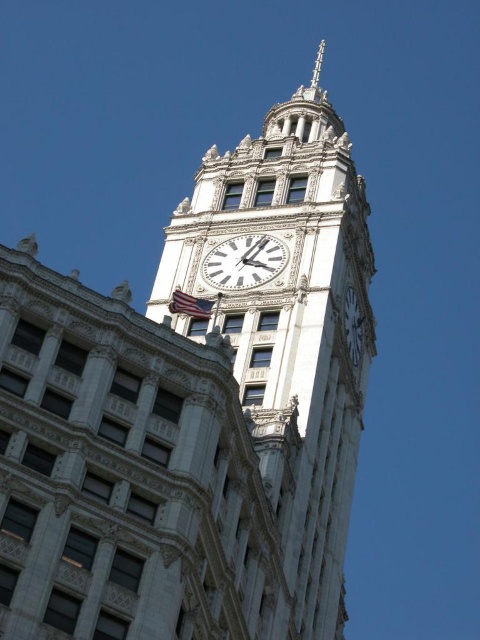
This screenshot has width=480, height=640. What are the coordinates of `white stone clock tower at center` in the screenshot? It's located at (291, 317).

Can you confirm if white stone clock tower at center is positioned to the right of american flag at center?

Correct, you'll find white stone clock tower at center to the right of american flag at center.

Which is in front, point (348, 388) or point (187, 292)?

Point (187, 292)

Where is `white stone clock tower at center`? Image resolution: width=480 pixels, height=640 pixels. white stone clock tower at center is located at coordinates (291, 317).

Which is behind, point (360, 332) or point (320, 67)?

The point (320, 67) is behind.

Is white stone clock at upper center to the right of polished silver spire at upper center from the viewer's perspective?

In fact, white stone clock at upper center is to the left of polished silver spire at upper center.

The width and height of the screenshot is (480, 640). I want to click on white stone clock at upper center, so click(352, 324).

Is white stone clock at upper center positioned before american flag at center?

No, white stone clock at upper center is further to the viewer.

In the scene shown: Who is higher up, white stone clock at upper center or american flag at center?

american flag at center

What do you see at coordinates (352, 324) in the screenshot?
I see `white stone clock at upper center` at bounding box center [352, 324].

Find the location of `white stone clock at upper center`. white stone clock at upper center is located at coordinates (352, 324).